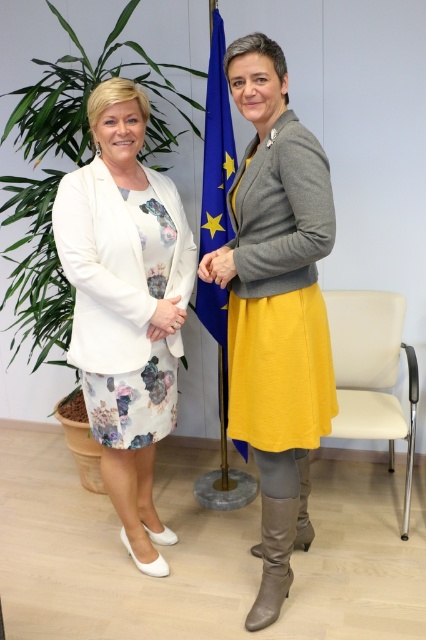
Who is taller, leather high-heeled boot at lower center or matte white hand at center?

With more height is leather high-heeled boot at lower center.

Consider the image. Is leather high-heeled boot at lower center above matte white hand at center?

No.

Based on the photo, who is more distant from viewer, (281, 573) or (167, 301)?

Positioned behind is point (167, 301).

Where is `leather high-heeled boot at lower center`? leather high-heeled boot at lower center is located at coordinates (273, 560).

Does matte yellow skirt at center have a lesser width compared to leather boot at lower center?

No.

Which is in front, point (324, 227) or point (302, 541)?

Point (324, 227) is in front.

In order to click on matte yellow skirt at center in this screenshot , I will do `click(279, 292)`.

From the picture: Is the position of matte gray sweater at center more distant than that of matte yellow skirt at center?

Yes, matte gray sweater at center is behind matte yellow skirt at center.

Between point (316, 339) and point (252, 189), which one is positioned in front?

Point (252, 189)

Which is in front, point (215, 276) or point (245, 378)?

Point (215, 276) is more forward.

Identify the location of matte gray sweater at center. Image resolution: width=426 pixels, height=640 pixels. (276, 307).